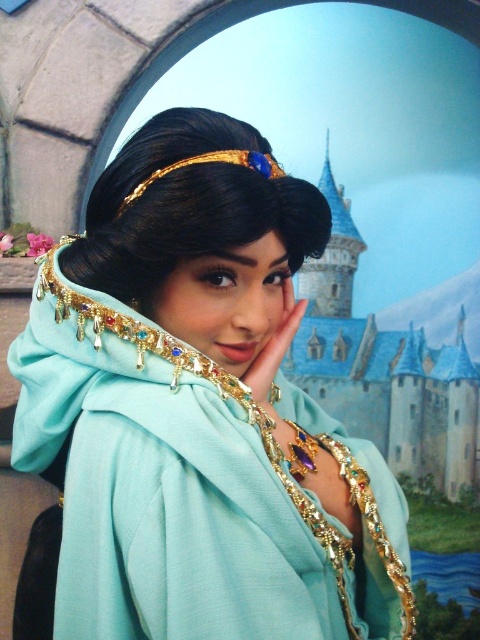
Question: Does matte teal fabric at center appear on the left side of gold metallic tiara at upper center?

Choices:
 (A) no
 (B) yes

Answer: (B)

Question: Is shiny gold headband at center above gold metallic tiara at upper center?

Choices:
 (A) no
 (B) yes

Answer: (A)

Question: Which point is closer to the camera?

Choices:
 (A) gold metallic tiara at upper center
 (B) shiny gold headband at center
 (C) matte teal fabric at center

Answer: (C)

Question: Which object appears closest to the camera in this image?

Choices:
 (A) matte teal fabric at center
 (B) gold metallic tiara at upper center
 (C) shiny gold headband at center

Answer: (A)

Question: Based on their relative distances, which object is farther from the gold metallic tiara at upper center?

Choices:
 (A) matte teal fabric at center
 (B) shiny gold headband at center

Answer: (A)

Question: Can you confirm if matte teal fabric at center is positioned below gold metallic tiara at upper center?

Choices:
 (A) no
 (B) yes

Answer: (B)